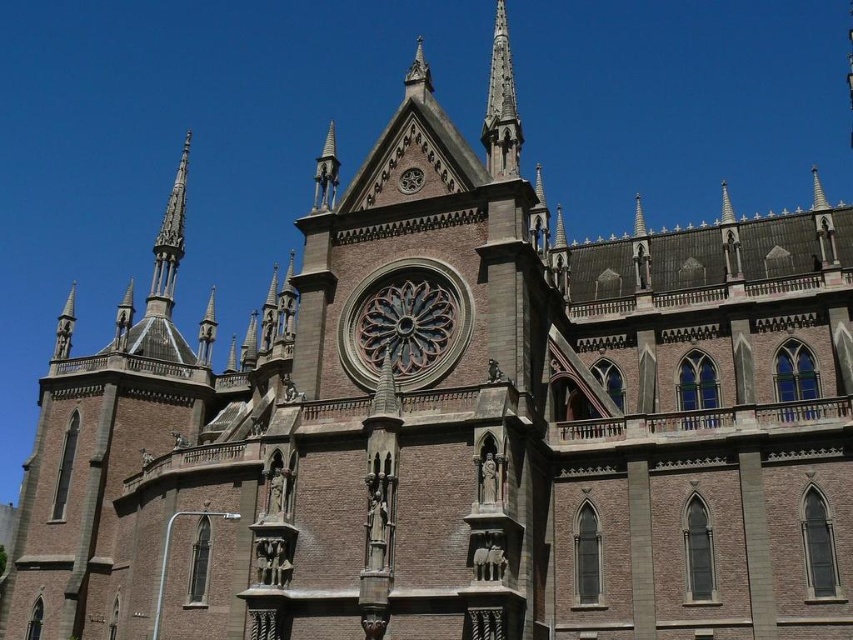
Is smooth stone spire at upper center wider than carved stone spire at upper left?

No.

Is smooth stone spire at upper center shorter than carved stone spire at upper left?

No.

In order to click on smooth stone spire at upper center in this screenshot , I will do `click(502, 106)`.

Locate an element on the screen. smooth stone spire at upper center is located at coordinates (502, 106).